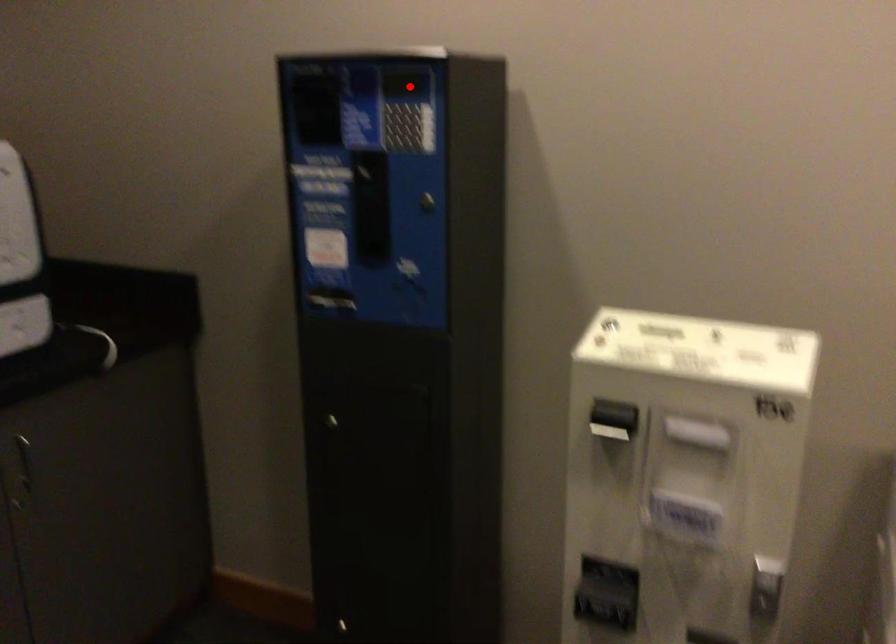
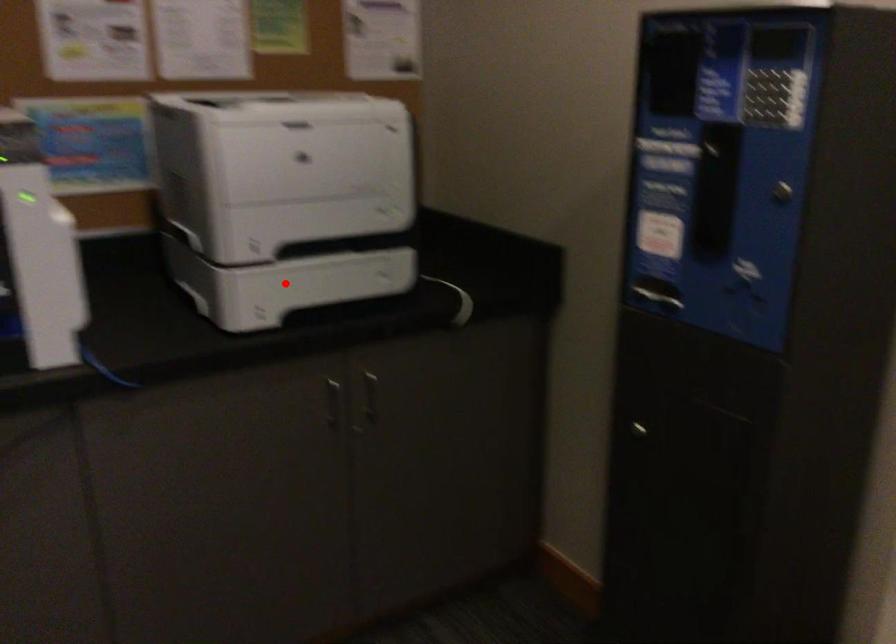
I am providing you with two images of the same scene from different viewpoints. A red point is marked on the first image and another point is marked on the second image. Does the point marked in image1 correspond to the same location as the one in image2?

No